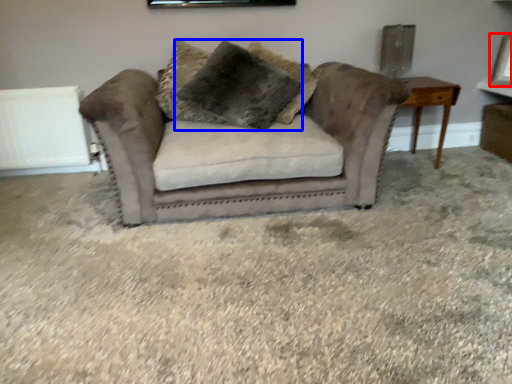
Question: Among these objects, which one is nearest to the camera, picture frame (highlighted by a red box) or pillow (highlighted by a blue box)?

Choices:
 (A) picture frame
 (B) pillow

Answer: (B)